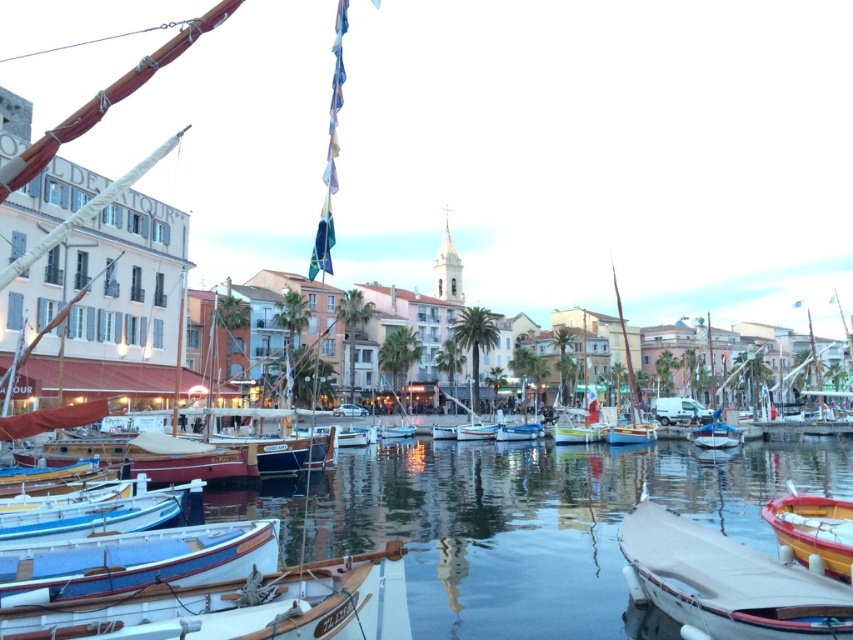
You are a tour guide explaining the harbor layout to visitors. You mention the wooden boat at lower left and the wooden sailboat at center. Which one is narrower?

The wooden boat at lower left is narrower than the wooden sailboat at center.

You are standing at the edge of the harbor and see the blue polished wood boat at lower left and the wooden boat at lower right. Which boat would appear larger to you?

The blue polished wood boat at lower left is closer to the viewer than the wooden boat at lower right, so it would appear larger.

Based on the photo, you are a tour guide explaining the harbor to visitors. You mention both the white canvas boat at lower right and the blue polished wood boat at lower left. Which boat would you describe as bigger?

The white canvas boat at lower right is larger in size than the blue polished wood boat at lower left.